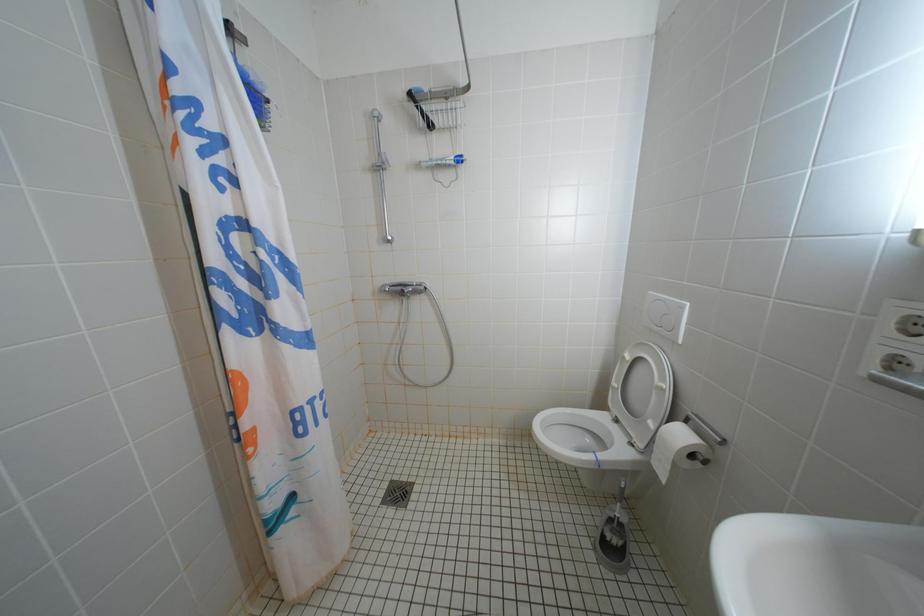
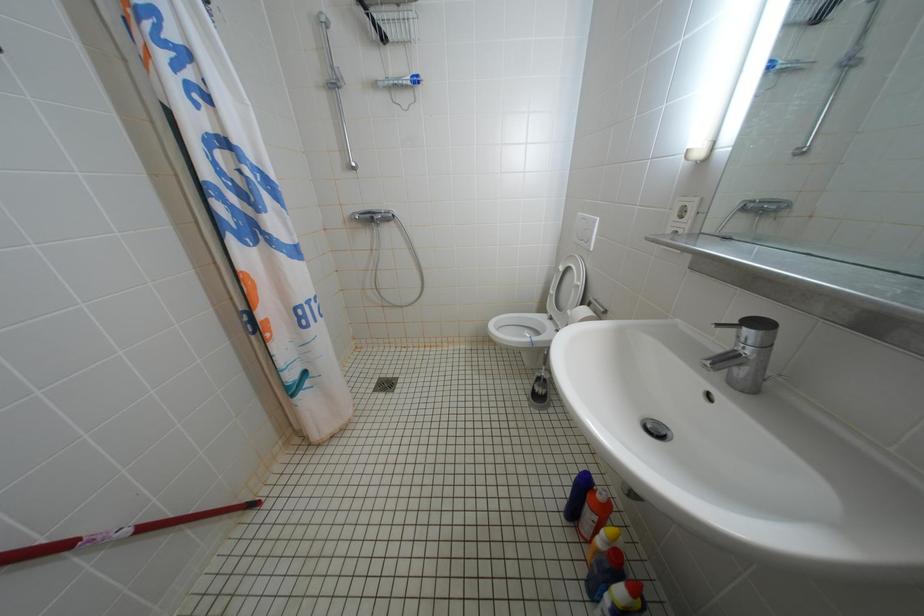
Question: Which direction would the cameraman need to move to produce the second image? Reply with the corresponding letter.

Choices:
 (A) Left
 (B) Right
 (C) Forward
 (D) Backward

Answer: (D)